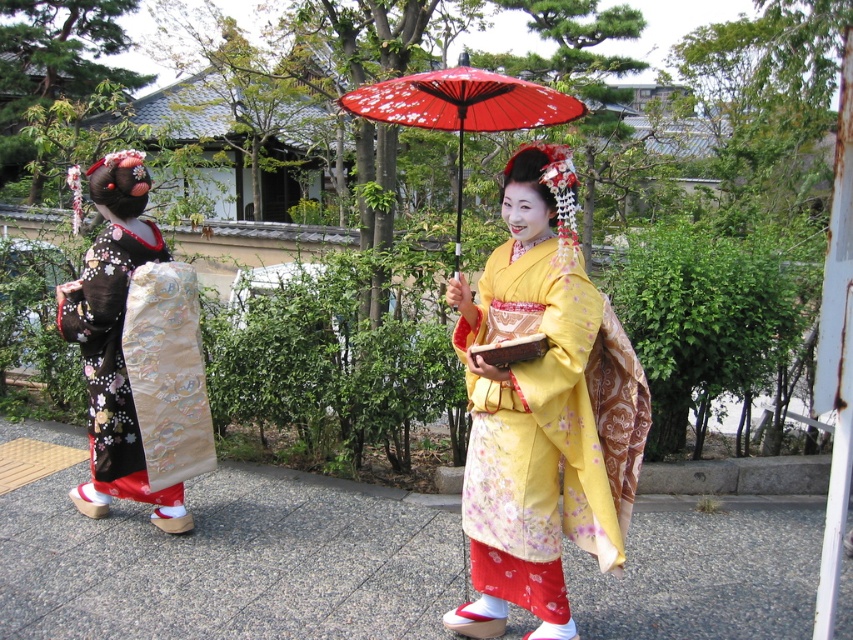
Question: Can you confirm if gray concrete pavement at center is positioned below yellow silk kimono at center?

Choices:
 (A) no
 (B) yes

Answer: (B)

Question: Which point appears closest to the camera in this image?

Choices:
 (A) (61, 604)
 (B) (427, 109)
 (C) (103, 204)

Answer: (B)

Question: From the image, what is the correct spatial relationship of gray concrete pavement at center in relation to yellow silk kimono at center?

Choices:
 (A) above
 (B) below

Answer: (B)

Question: Is gray concrete pavement at center wider than yellow silk kimono at center?

Choices:
 (A) no
 (B) yes

Answer: (B)

Question: Which point is closer to the camera?

Choices:
 (A) pyautogui.click(x=444, y=509)
 (B) pyautogui.click(x=517, y=93)

Answer: (B)

Question: Based on their relative distances, which object is farther from the yellow silk kimono at center?

Choices:
 (A) red paper parasol at center
 (B) gray concrete pavement at center

Answer: (A)